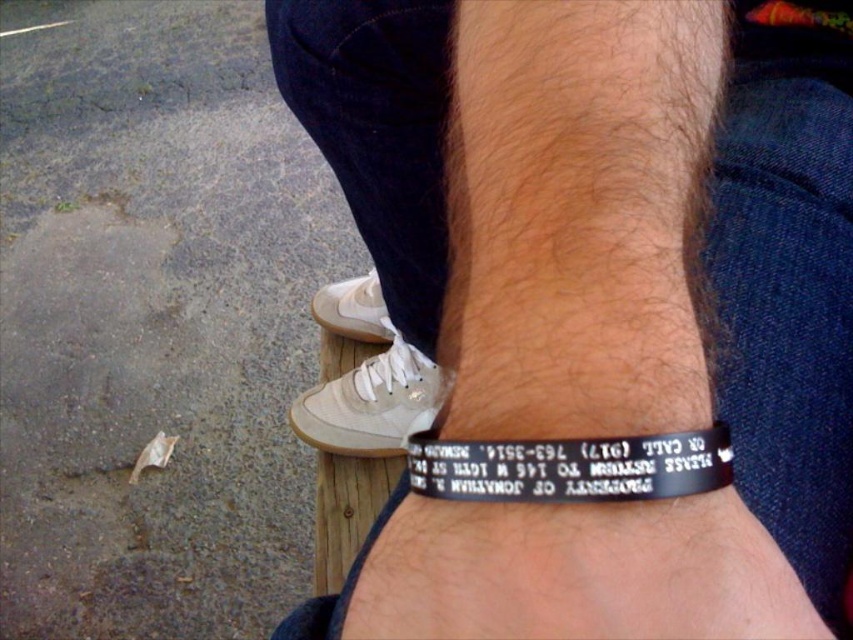
Looking at this image, between light beige suede shoe at lower center and white leather shoe at lower center, which one appears on the right side from the viewer's perspective?

light beige suede shoe at lower center is more to the right.

Who is more distant from viewer, (409, 355) or (364, 332)?

Positioned behind is point (364, 332).

This screenshot has height=640, width=853. Identify the location of light beige suede shoe at lower center. (372, 404).

Does black rubber bracelet at center have a lesser height compared to light beige suede shoe at lower center?

No.

Locate an element on the screen. Image resolution: width=853 pixels, height=640 pixels. black rubber bracelet at center is located at coordinates 595,301.

What do you see at coordinates (595, 301) in the screenshot?
I see `black rubber bracelet at center` at bounding box center [595, 301].

Where is `black rubber bracelet at center`? Image resolution: width=853 pixels, height=640 pixels. black rubber bracelet at center is located at coordinates pos(595,301).

How far apart are black rubber bracelet at center and white leather shoe at lower center?

16.58 inches

Who is more distant from viewer, (850,456) or (347,284)?

Positioned behind is point (347,284).

Where is `black rubber bracelet at center`? black rubber bracelet at center is located at coordinates (595, 301).